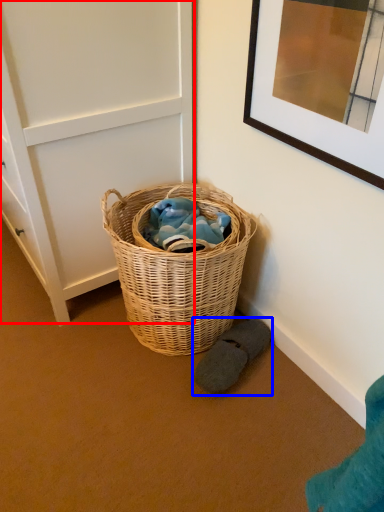
Question: Which of the following is the closest to the observer, door (highlighted by a red box) or footwear (highlighted by a blue box)?

Choices:
 (A) door
 (B) footwear

Answer: (A)